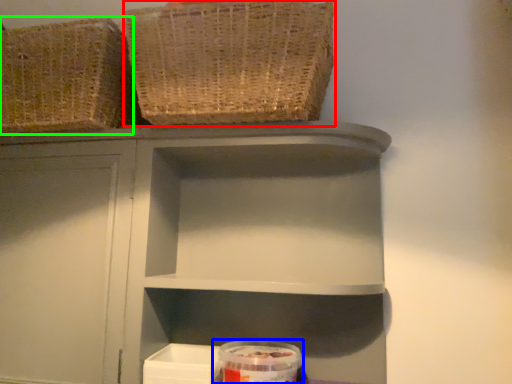
Question: Which is nearer to the basket (highlighted by a red box)? glass jar (highlighted by a blue box) or basket (highlighted by a green box).

Choices:
 (A) glass jar
 (B) basket

Answer: (B)